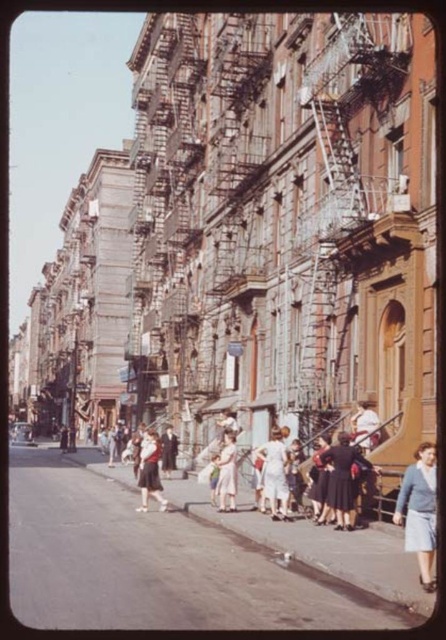
You are a photographer standing on the street in this scene. You want to take a photo that includes both the light blue fabric dress at lower right and the white cotton dress at center. Given that your camera has a maximum zoom range of 10 meters, will you be able to capture both subjects in a single frame without moving your position?

The light blue fabric dress at lower right and the white cotton dress at center are 11.70 meters apart from each other. Since the camera can only zoom up to 10 meters, the distance between them exceeds the maximum zoom range. Therefore, you cannot capture both subjects in a single frame without moving your position.